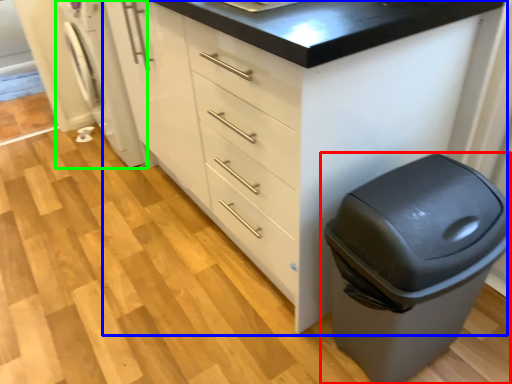
Question: Which object is the farthest from waste container (highlighted by a red box)? Choose among these: chest of drawers (highlighted by a blue box) or washing machine (highlighted by a green box).

Choices:
 (A) chest of drawers
 (B) washing machine

Answer: (B)